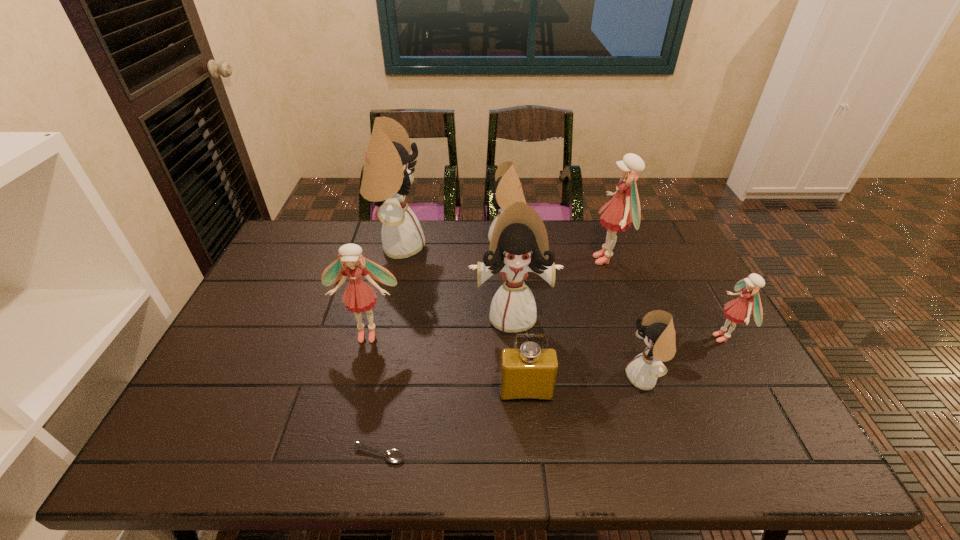
This screenshot has height=540, width=960. I want to click on the biggest black doll, so (387, 176).

At what (x,y) coordinates should I click in order to perform the action: click on the tallest doll. Please return your answer as a coordinate pair (x, y). Looking at the image, I should click on (387, 176).

Locate an element on the screen. the biggest pink doll is located at coordinates (624, 208).

At what (x,y) coordinates should I click in order to perform the action: click on the second pink doll from left to right. Please return your answer as a coordinate pair (x, y). The width and height of the screenshot is (960, 540). Looking at the image, I should click on pos(624,208).

At what (x,y) coordinates should I click in order to perform the action: click on the third smallest black doll. Please return your answer as a coordinate pair (x, y). Looking at the image, I should click on 519,244.

The width and height of the screenshot is (960, 540). What are the coordinates of `the second smallest black doll` in the screenshot? It's located at (507, 189).

The height and width of the screenshot is (540, 960). In order to click on the leftmost pink doll in this screenshot , I will do `click(359, 296)`.

The height and width of the screenshot is (540, 960). What are the coordinates of `the rightmost doll` in the screenshot? It's located at (737, 311).

This screenshot has height=540, width=960. What are the coordinates of `the rightmost object` in the screenshot? It's located at (737, 311).

At what (x,y) coordinates should I click in order to perform the action: click on the nearest black doll. Please return your answer as a coordinate pair (x, y). Looking at the image, I should click on (657, 329).